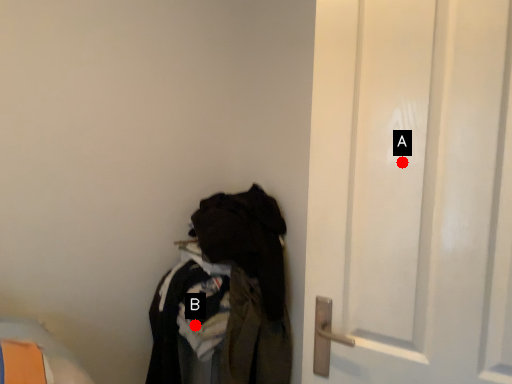
Question: Two points are circled on the image, labeled by A and B beside each circle. Which point appears closest to the camera in this image?

Choices:
 (A) A is closer
 (B) B is closer

Answer: (A)